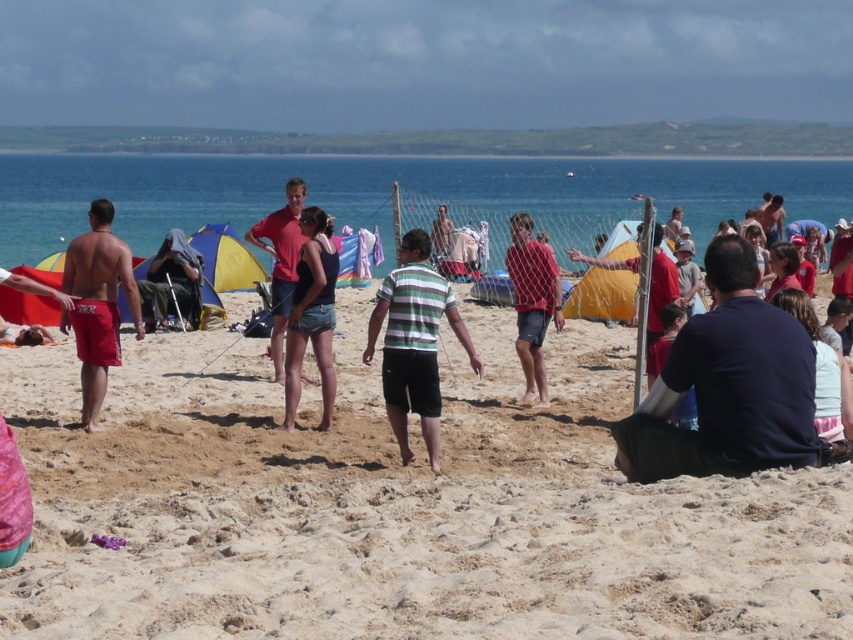
You are a photographer at the beach scene. You want to capture a photo that includes both the matte red shorts at left and the red matte shirt at center. Based on their positions, where should you position the camera to ensure both items are in the frame?

To include both the matte red shorts at left and the red matte shirt at center in the photo, position the camera at a higher angle since the matte red shorts at left is located below the red matte shirt at center.

You are standing at the origin point of the image. Which object is closer to you, the matte red shorts at left or the clothesline between two poles? Please provide coordinates for both objects to justify your answer.

The matte red shorts at left is located at point (97, 305) and the clothesline between two poles is at point (254, 320). Since the y coordinate of the matte red shorts at left is lower, it is closer to the viewer. Therefore, the matte red shorts at left is closer.